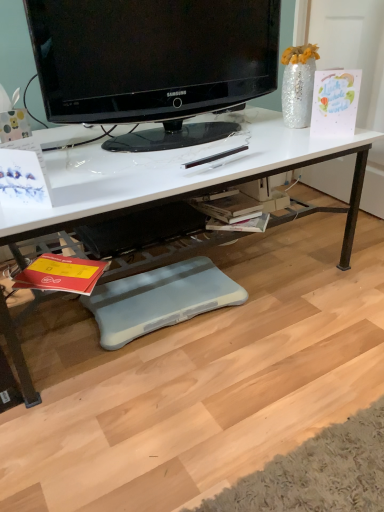
Where is `free spot above blue foam footrest at lower center (from a real-world perspective)`? The height and width of the screenshot is (512, 384). free spot above blue foam footrest at lower center (from a real-world perspective) is located at coordinates (157, 294).